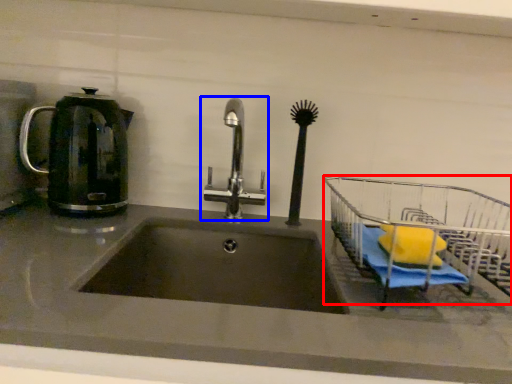
Question: Which object appears closest to the camera in this image, cart (highlighted by a red box) or tap (highlighted by a blue box)?

Choices:
 (A) cart
 (B) tap

Answer: (A)